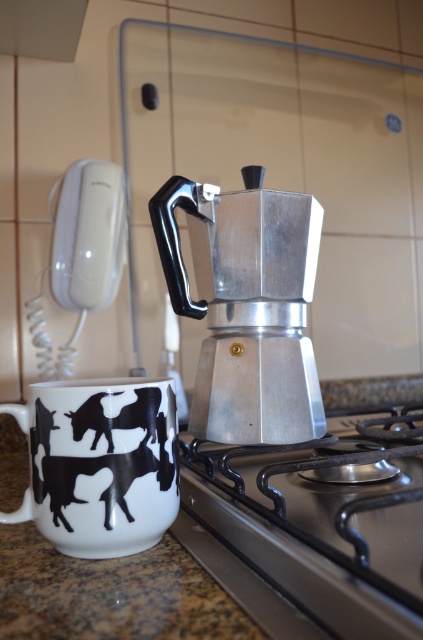
Question: Can you confirm if silver metallic coffee maker at center is positioned below granite countertop at lower left?

Choices:
 (A) yes
 (B) no

Answer: (B)

Question: Which of the following is the farthest from the observer?

Choices:
 (A) (2, 528)
 (B) (60, 445)
 (C) (266, 465)
 (D) (233, 316)

Answer: (C)

Question: Does silver metallic coffee maker at center appear on the right side of granite countertop at lower left?

Choices:
 (A) yes
 (B) no

Answer: (A)

Question: Which point is farther to the camera?

Choices:
 (A) (269, 218)
 (B) (239, 456)
 (C) (159, 604)
 (D) (24, 496)

Answer: (B)

Question: Is stainless steel gas stove at center positioned at the back of silver metallic coffee maker at center?

Choices:
 (A) no
 (B) yes

Answer: (A)

Question: Which object is positioned farthest from the granite countertop at lower left?

Choices:
 (A) stainless steel gas stove at center
 (B) silver metallic coffee maker at center

Answer: (B)